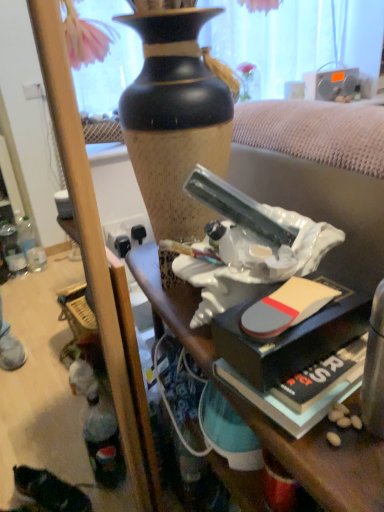
Where is `silver metallic radio at upper right`? This screenshot has height=512, width=384. silver metallic radio at upper right is located at coordinates (330, 84).

Measure the distance between point (329,92) and camera.

→ Point (329,92) is 5.74 feet from camera.

Find the location of a particular element. The width and height of the screenshot is (384, 512). hardcover book at lower right is located at coordinates (322, 377).

You are a GUI agent. You are given a task and a screenshot of the screen. Output one action in this format:
    pyautogui.click(x=<x>, y=<y>)
    Task: Click on the white glossy statue at center
    The image size is (384, 512).
    Given the screenshot: What is the action you would take?
    pyautogui.click(x=266, y=416)

Which is behind, hardcover book at lower right or silver metallic radio at upper right?

silver metallic radio at upper right is further from the camera.

Which is more to the right, hardcover book at lower right or silver metallic radio at upper right?

Positioned to the right is silver metallic radio at upper right.

The width and height of the screenshot is (384, 512). What are the coordinates of `paperback book located below the silver metallic radio at upper right (from the image's perspective)` in the screenshot? It's located at (322, 377).

In terms of width, does white glossy statue at center look wider or thinner when compared to silver metallic radio at upper right?

Clearly, white glossy statue at center has more width compared to silver metallic radio at upper right.

Is white glossy statue at center oriented away from silver metallic radio at upper right?

That's not correct — white glossy statue at center is not looking away from silver metallic radio at upper right.

In the image, there is a silver metallic radio at upper right. Where is `desk below it (from a real-world perspective)`? This screenshot has height=512, width=384. desk below it (from a real-world perspective) is located at coordinates (266, 416).

Consider the image. From the image's perspective, which object appears higher, hardcover book at lower right or white glossy statue at center?

hardcover book at lower right appears higher in the image.

How far apart are hardcover book at lower right and white glossy statue at center?

They are 7.01 inches apart.

Which object is wider, hardcover book at lower right or white glossy statue at center?

white glossy statue at center is wider.

Are hardcover book at lower right and white glossy statue at center far apart?

That's not correct — hardcover book at lower right is a little close to white glossy statue at center.

Consider the image. Looking at the image, does silver metallic radio at upper right seem bigger or smaller compared to hardcover book at lower right?

Clearly, silver metallic radio at upper right is larger in size than hardcover book at lower right.

The height and width of the screenshot is (512, 384). Find the location of `paperback book in front of the silver metallic radio at upper right`. paperback book in front of the silver metallic radio at upper right is located at coordinates (322, 377).

Is silver metallic radio at upper right inside or outside of hardcover book at lower right?

silver metallic radio at upper right is located beyond the bounds of hardcover book at lower right.

From the image's perspective, is silver metallic radio at upper right beneath hardcover book at lower right?

No, from the image's perspective, silver metallic radio at upper right is not beneath hardcover book at lower right.

Considering the positions of objects silver metallic radio at upper right and white glossy statue at center in the image provided, who is in front, silver metallic radio at upper right or white glossy statue at center?

white glossy statue at center is in front.

How much distance is there between silver metallic radio at upper right and white glossy statue at center?

silver metallic radio at upper right is 1.31 meters away from white glossy statue at center.

Does silver metallic radio at upper right have a larger size compared to white glossy statue at center?

Incorrect, silver metallic radio at upper right is not larger than white glossy statue at center.

From a real-world perspective, which is physically above, silver metallic radio at upper right or white glossy statue at center?

silver metallic radio at upper right, from a real-world perspective.

What's the angular difference between white glossy statue at center and hardcover book at lower right's facing directions?

2.78 degrees.

Is point (283, 444) positioned after point (275, 393)?

No, it is not.

Relative to hardcover book at lower right, is white glossy statue at center in front or behind?

white glossy statue at center is positioned closer to the viewer than hardcover book at lower right.

Is white glossy statue at center inside the boundaries of hardcover book at lower right, or outside?

white glossy statue at center exists outside the volume of hardcover book at lower right.

Find the location of a particular element. The width and height of the screenshot is (384, 512). paperback book that is under the silver metallic radio at upper right (from a real-world perspective) is located at coordinates (322, 377).

The height and width of the screenshot is (512, 384). In order to click on loudspeaker above the white glossy statue at center (from the image's perspective) in this screenshot , I will do `click(330, 84)`.

Based on the photo, when comparing their distances from white glossy statue at center, does hardcover book at lower right or silver metallic radio at upper right seem closer?

Based on the image, hardcover book at lower right appears to be nearer to white glossy statue at center.

When comparing their distances from silver metallic radio at upper right, does white glossy statue at center or hardcover book at lower right seem closer?

The object closer to silver metallic radio at upper right is white glossy statue at center.

Which object lies nearer to the anchor point hardcover book at lower right, silver metallic radio at upper right or white glossy statue at center?

white glossy statue at center lies closer to hardcover book at lower right than the other object.

From the image, which object appears to be nearer to white glossy statue at center, silver metallic radio at upper right or hardcover book at lower right?

hardcover book at lower right.

Looking at the image, which one is located closer to silver metallic radio at upper right, hardcover book at lower right or white glossy statue at center?

Based on the image, white glossy statue at center appears to be nearer to silver metallic radio at upper right.

When comparing their distances from hardcover book at lower right, does white glossy statue at center or silver metallic radio at upper right seem further?

Based on the image, silver metallic radio at upper right appears to be further to hardcover book at lower right.

The height and width of the screenshot is (512, 384). I want to click on paperback book located between white glossy statue at center and silver metallic radio at upper right in the depth direction, so click(322, 377).